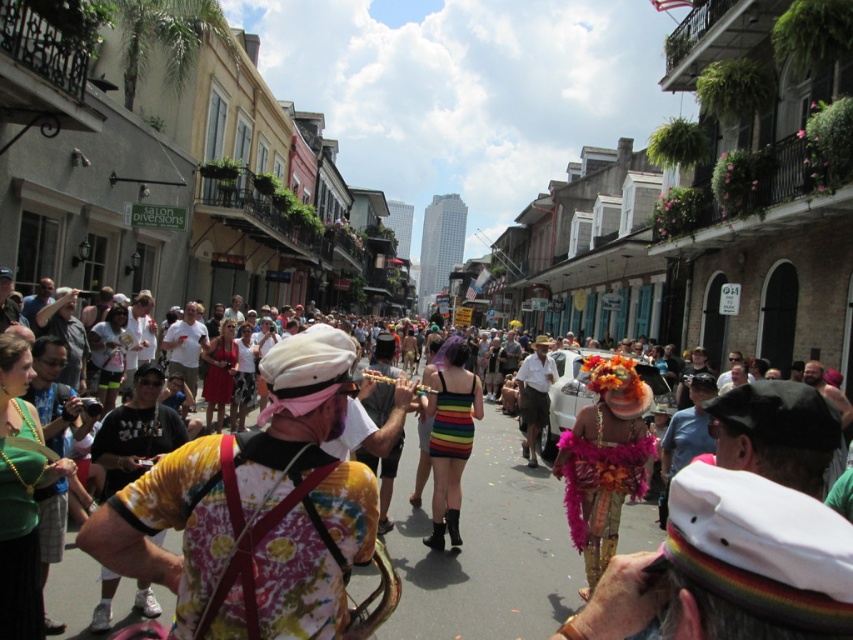
Is tie-dye fabric saxophone at center smaller than rainbow striped dress at center?

Incorrect, tie-dye fabric saxophone at center is not smaller in size than rainbow striped dress at center.

Is point (128, 502) more distant than point (471, 433)?

That is False.

Does point (271, 433) come behind point (431, 435)?

No.

Find the location of a particular element. This screenshot has height=640, width=853. tie-dye fabric saxophone at center is located at coordinates (254, 509).

Is tie-dye fabric saxophone at center shorter than floral tie-dye shirt at center?

Yes.

Which is behind, point (241, 442) or point (508, 458)?

The point (508, 458) is behind.

At what (x,y) coordinates should I click in order to perform the action: click on tie-dye fabric saxophone at center. Please return your answer as a coordinate pair (x, y). Looking at the image, I should click on (254, 509).

Can you confirm if floral tie-dye shirt at center is wider than rainbow striped dress at center?

Yes, floral tie-dye shirt at center is wider than rainbow striped dress at center.

Image resolution: width=853 pixels, height=640 pixels. What do you see at coordinates (485, 548) in the screenshot?
I see `floral tie-dye shirt at center` at bounding box center [485, 548].

This screenshot has height=640, width=853. I want to click on floral tie-dye shirt at center, so click(485, 548).